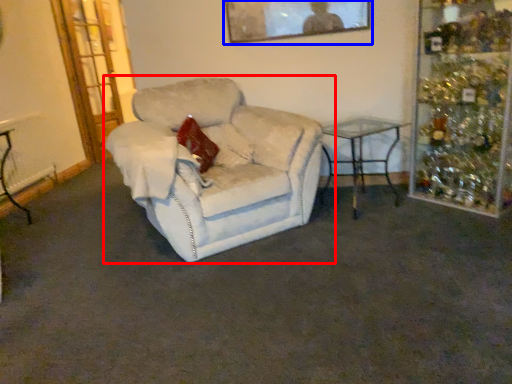
Question: Which point is closer to the camera, chair (highlighted by a red box) or picture frame (highlighted by a blue box)?

Choices:
 (A) chair
 (B) picture frame

Answer: (A)